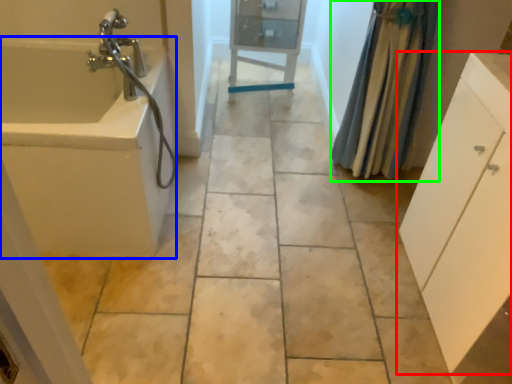
Question: Based on their relative distances, which object is farther from bathroom cabinet (highlighted by a red box)? Choose from bath (highlighted by a blue box) and shower curtain (highlighted by a green box).

Choices:
 (A) bath
 (B) shower curtain

Answer: (A)